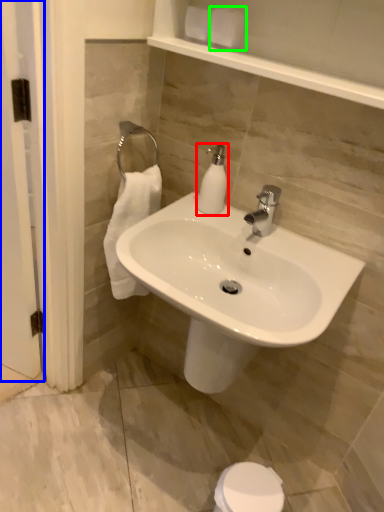
Question: Based on their relative distances, which object is nearer to soap dispenser (highlighted by a red box)? Choose from screen door (highlighted by a blue box) and toilet paper (highlighted by a green box).

Choices:
 (A) screen door
 (B) toilet paper

Answer: (B)